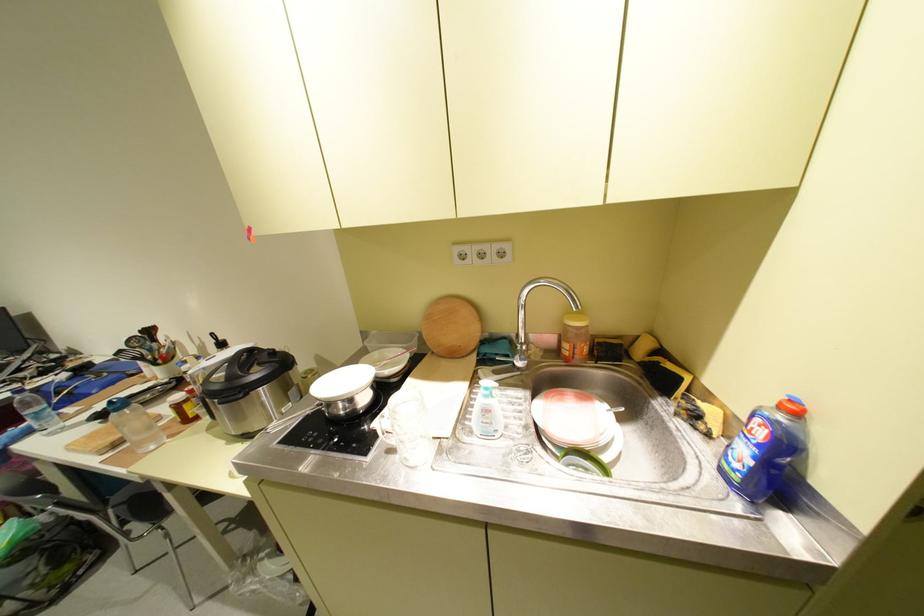
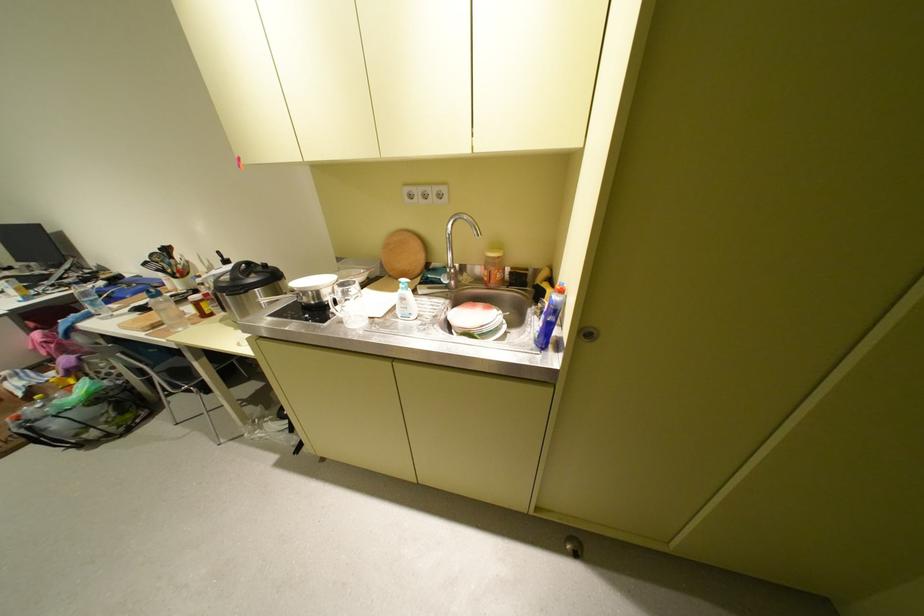
The point at (484, 359) is marked in the first image. Where is the corresponding point in the second image?

(429, 280)